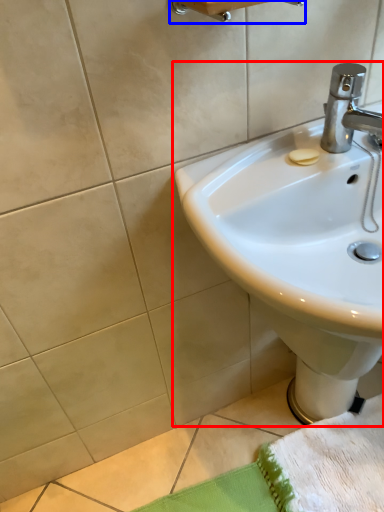
Question: Which point is further to the camera, sink (highlighted by a red box) or towel bar (highlighted by a blue box)?

Choices:
 (A) sink
 (B) towel bar

Answer: (B)